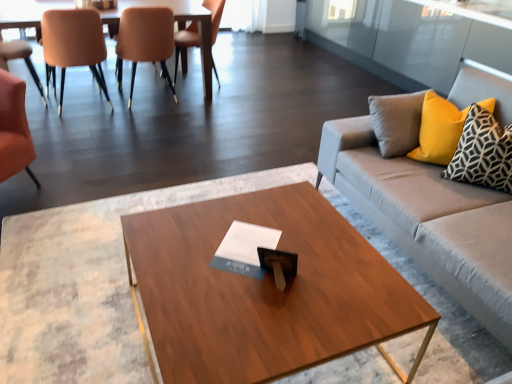
Locate an element on the screen. Image resolution: width=512 pixels, height=384 pixels. free spot above wooden coffee table at center (from a real-world perspective) is located at coordinates (265, 271).